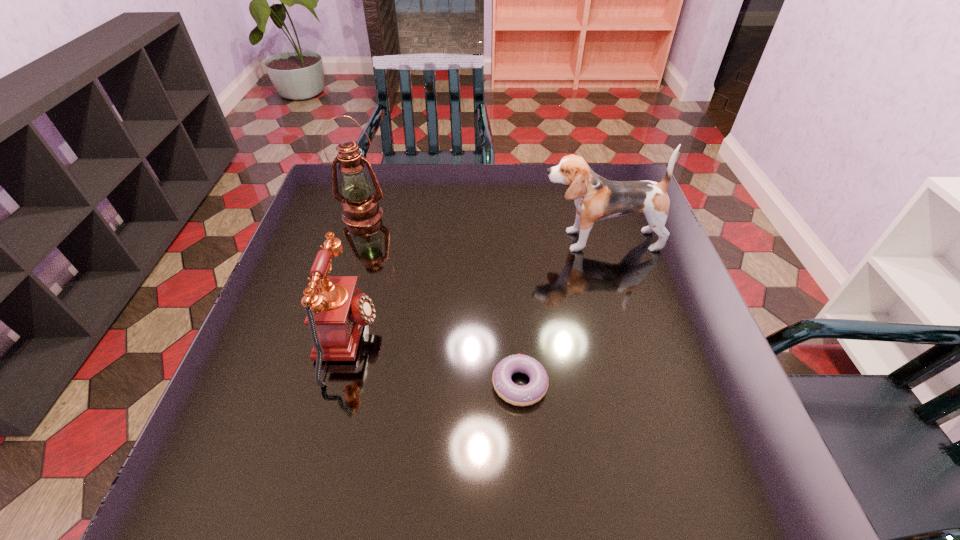
The height and width of the screenshot is (540, 960). What are the coordinates of `oil lamp` in the screenshot? It's located at (360, 207).

Image resolution: width=960 pixels, height=540 pixels. Identify the location of the third nearest object. (596, 198).

Find the location of `puppy`. puppy is located at coordinates (596, 198).

Where is `the second shortest object`? the second shortest object is located at coordinates (336, 312).

Find the location of a particular element. The height and width of the screenshot is (540, 960). the shortest object is located at coordinates (534, 391).

Where is `doughnut`? The width and height of the screenshot is (960, 540). doughnut is located at coordinates (534, 391).

At what (x,y) coordinates should I click in order to perform the action: click on vacant space situated 0.240m on the front of the oil lamp. Please return your answer as a coordinate pair (x, y). Image resolution: width=960 pixels, height=540 pixels. Looking at the image, I should click on (339, 289).

Locate an element on the screen. vacant space located at the face of the puppy is located at coordinates (468, 240).

Locate an element on the screen. This screenshot has width=960, height=540. free point located 0.050m at the face of the puppy is located at coordinates [519, 240].

Identify the location of free space located at the face of the puppy. (430, 240).